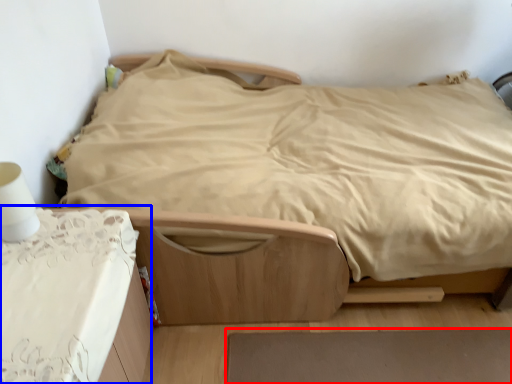
Question: Which of the following is the closest to the observer, plain (highlighted by a red box) or table (highlighted by a blue box)?

Choices:
 (A) plain
 (B) table

Answer: (B)